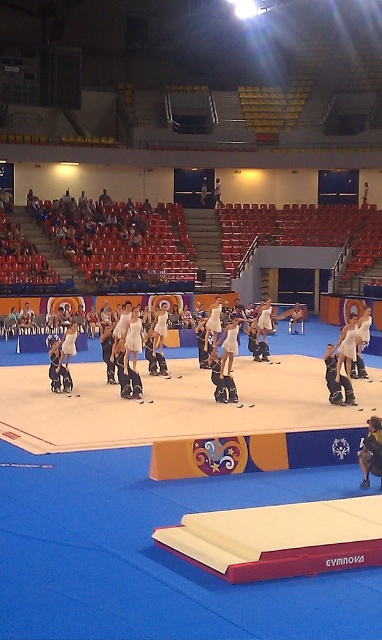
Which is in front, point (380, 426) or point (216, 205)?

Point (380, 426) is more forward.

Is point (380, 426) positioned after point (213, 195)?

No, it is not.

Is point (370, 472) behind point (220, 184)?

No, it is in front of (220, 184).

Find the location of `dark blue fabric at center`. dark blue fabric at center is located at coordinates (370, 451).

Can you confirm if dark blue fabric at center is positioned to the left of white matte gymnastics outfit at center?

Indeed, dark blue fabric at center is positioned on the left side of white matte gymnastics outfit at center.

Is dark blue fabric at center below white matte gymnastics outfit at center?

Yes, dark blue fabric at center is below white matte gymnastics outfit at center.

Does point (369, 464) lie behind point (349, 365)?

No, it is not.

You are a GUI agent. You are given a task and a screenshot of the screen. Output one action in this format:
    pyautogui.click(x=<x>, y=<y>)
    Task: Click on the dark blue fabric at center
    
    Given the screenshot: What is the action you would take?
    pyautogui.click(x=370, y=451)

Describe the element at coordinates (336, 380) in the screenshot. This screenshot has width=382, height=640. I see `matte black gymnastics suit at center` at that location.

The image size is (382, 640). What do you see at coordinates (336, 380) in the screenshot? I see `matte black gymnastics suit at center` at bounding box center [336, 380].

Identify the location of matte black gymnastics suit at center. (336, 380).